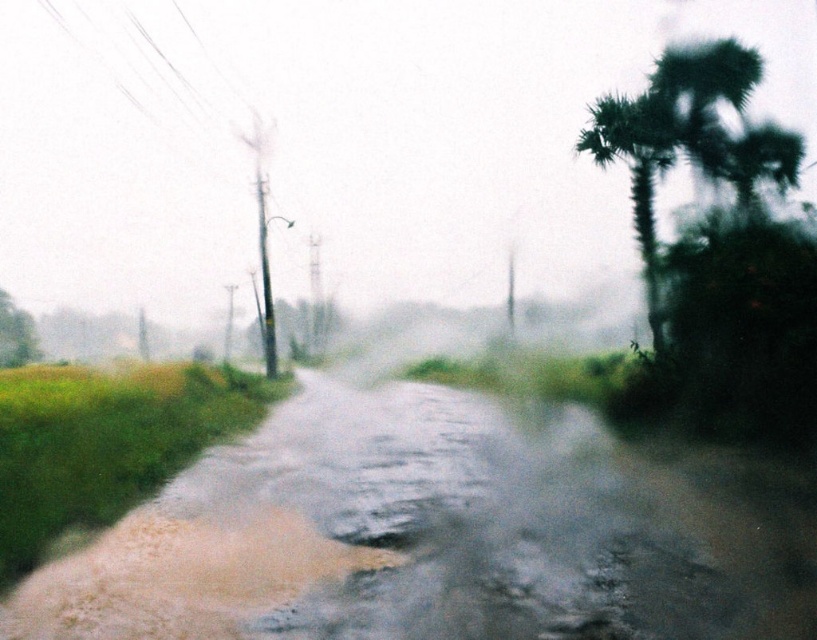
You are driving a car that is 2 meters wide. You need to pass through the road shown in the image. The brown mud at center and green leafy palm tree at right are on the road. Can your car fit through the space between them?

The brown mud at center has a lesser width compared to green leafy palm tree at right. Since the brown mud at center is narrower, the space between them might be sufficient for a 2m wide car. However, without exact measurements, it is uncertain. The answer depends on the total available space between both objects.

You are standing at the starting point of the rural road and want to reach the end of the road. Which point, point [521,608] or point [1,316], is closer to the road end?

Point [521,608] is in front of point [1,316], so it is closer to the road end.